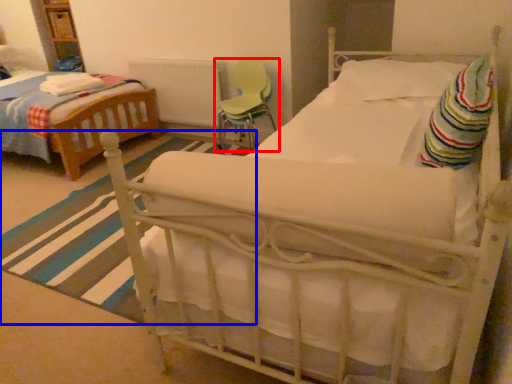
Question: Which object is further to the camera taking this photo, chair (highlighted by a red box) or stripe (highlighted by a blue box)?

Choices:
 (A) chair
 (B) stripe

Answer: (A)